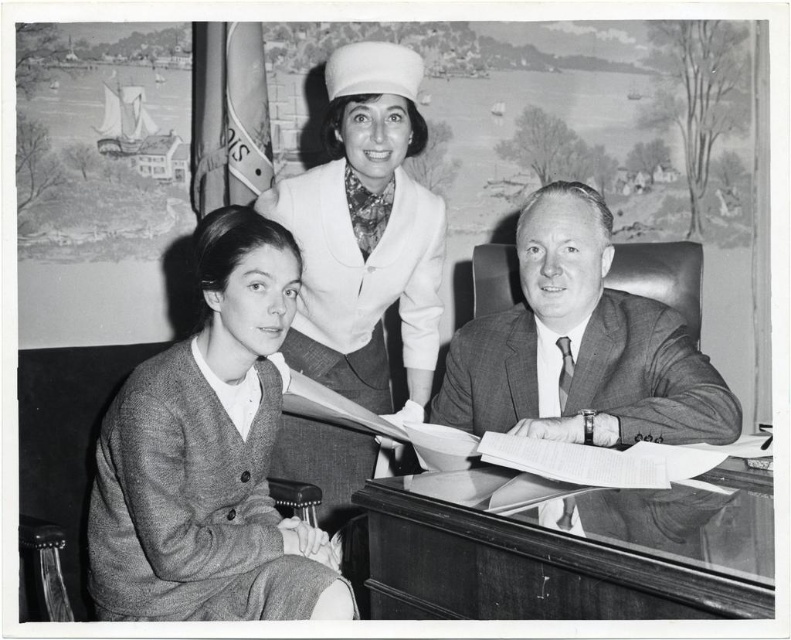
Based on the scene described, can you determine which object is taller between the textured gray cardigan at left and the smooth white hat at upper center?

The textured gray cardigan at left is not as tall as the smooth white hat at upper center, so the smooth white hat at upper center is taller.

You are an office worker who needs to identify which clothing item is closer to you in the photo. Which one is nearer to you between the textured gray cardigan at left and the smooth gray suit at center?

The textured gray cardigan at left is in front of the smooth gray suit at center, so it is closer to you.

You are a tailor measuring the distance between two garments in an office photo. The garments are the textured gray cardigan at left and the smooth gray suit at center. The tailor needs to know if there is enough space between them to fit a 24 inch ruler. Can you confirm?

The distance between the textured gray cardigan at left and the smooth gray suit at center is 24.39 inches, which is slightly more than 24 inches. Therefore, the ruler can fit between them with a small amount of space to spare.